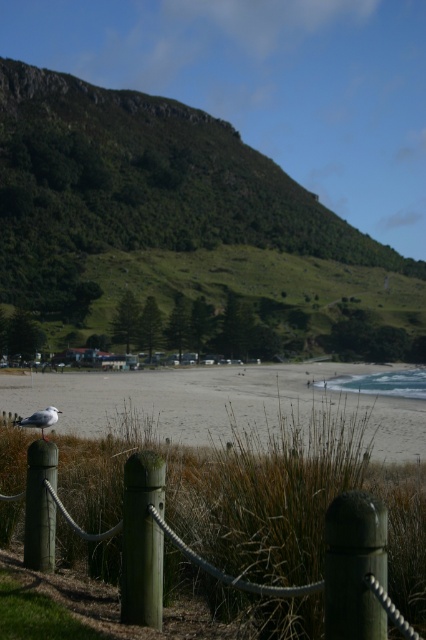
Question: Can you confirm if green wood fence at lower center is positioned below green matte post at center?

Choices:
 (A) no
 (B) yes

Answer: (A)

Question: Does green wood fence at lower center have a lesser width compared to green matte post at center?

Choices:
 (A) yes
 (B) no

Answer: (B)

Question: Which of the following is the closest to the observer?

Choices:
 (A) green matte post at lower left
 (B) green matte post at center
 (C) green wood fence at lower center

Answer: (C)

Question: Is green wood fence at lower center smaller than white matte bird at center?

Choices:
 (A) yes
 (B) no

Answer: (A)

Question: Which of the following is the farthest from the observer?

Choices:
 (A) green matte post at center
 (B) beige sand at center
 (C) green matte pole at center
 (D) green matte post at lower left

Answer: (D)

Question: Which point is closer to the camera?

Choices:
 (A) (65, 282)
 (B) (376, 568)
 (C) (143, 545)

Answer: (B)